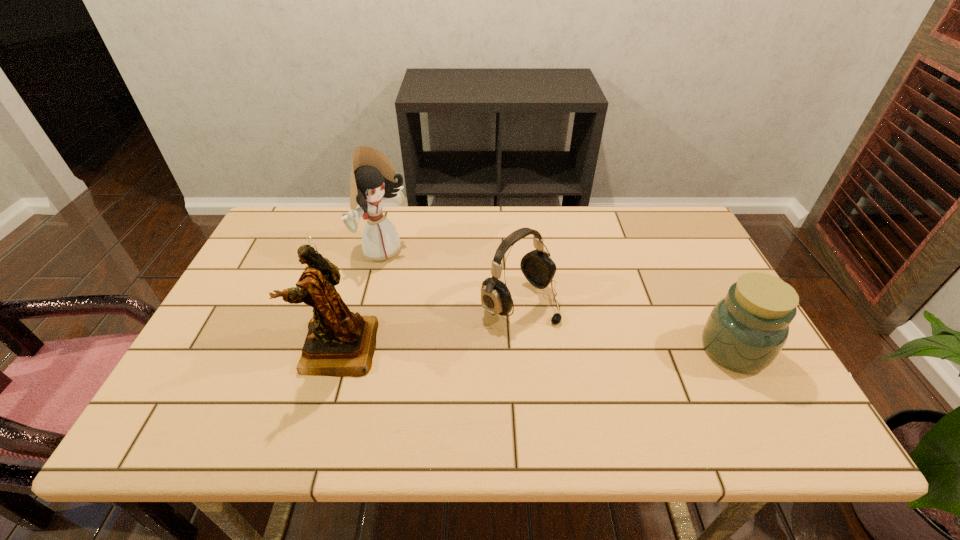
Locate an element on the screen. free space at the near edge of the desktop is located at coordinates (592, 380).

This screenshot has height=540, width=960. Find the location of `free space at the left edge`. free space at the left edge is located at coordinates (256, 259).

The width and height of the screenshot is (960, 540). I want to click on vacant space at the right edge of the desktop, so click(719, 287).

I want to click on vacant space at the far left corner, so click(x=281, y=215).

Where is `vacant area that lies between the jar and the farthest object`? vacant area that lies between the jar and the farthest object is located at coordinates (559, 300).

Locate an element on the screen. free spot between the figurine and the third object from left to right is located at coordinates (429, 326).

This screenshot has width=960, height=540. I want to click on unoccupied position between the doll and the rightmost object, so click(x=559, y=300).

Locate an element on the screen. The width and height of the screenshot is (960, 540). free space between the jar and the figurine is located at coordinates (536, 349).

At what (x,y) coordinates should I click in order to perform the action: click on vacant point located between the farthest object and the headset. Please return your answer as a coordinate pair (x, y). This screenshot has height=540, width=960. Looking at the image, I should click on (451, 276).

Identify the location of free space between the rightmost object and the headset. The width and height of the screenshot is (960, 540). (627, 326).